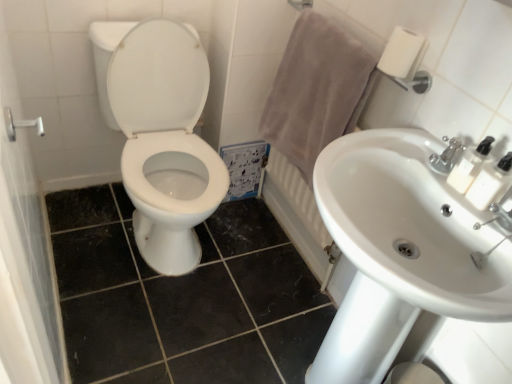
I want to click on vacant point to the left of white ceramic radiator at upper right, so click(x=231, y=238).